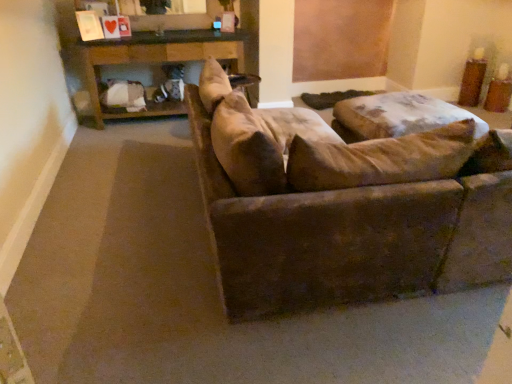
Question: Can you confirm if wooden table at upper center is positioned to the left of suede brown couch at center?

Choices:
 (A) yes
 (B) no

Answer: (A)

Question: Is wooden table at upper center in front of suede brown couch at center?

Choices:
 (A) yes
 (B) no

Answer: (B)

Question: Can you confirm if wooden table at upper center is bigger than suede brown couch at center?

Choices:
 (A) yes
 (B) no

Answer: (B)

Question: From the image's perspective, is wooden table at upper center on suede brown couch at center?

Choices:
 (A) no
 (B) yes

Answer: (B)

Question: Can you confirm if wooden table at upper center is positioned to the right of suede brown couch at center?

Choices:
 (A) yes
 (B) no

Answer: (B)

Question: Is suede brown couch at center a part of wooden table at upper center?

Choices:
 (A) no
 (B) yes

Answer: (A)

Question: Does suede brown couch at center come behind wooden table at upper center?

Choices:
 (A) no
 (B) yes

Answer: (A)

Question: Would you say suede brown couch at center is outside wooden table at upper center?

Choices:
 (A) no
 (B) yes

Answer: (B)

Question: From the image's perspective, is suede brown couch at center beneath wooden table at upper center?

Choices:
 (A) yes
 (B) no

Answer: (A)

Question: Is suede brown couch at center next to wooden table at upper center?

Choices:
 (A) yes
 (B) no

Answer: (B)

Question: Can you confirm if suede brown couch at center is taller than wooden table at upper center?

Choices:
 (A) yes
 (B) no

Answer: (A)

Question: Is suede brown couch at center oriented towards wooden table at upper center?

Choices:
 (A) yes
 (B) no

Answer: (A)

Question: Is suede brown couch at center taller or shorter than wooden table at upper center?

Choices:
 (A) tall
 (B) short

Answer: (A)